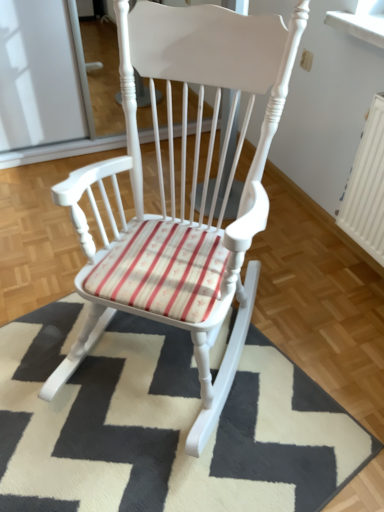
Identify the location of white wood rocking chair at center. This screenshot has height=512, width=384. (183, 185).

The height and width of the screenshot is (512, 384). What do you see at coordinates (183, 185) in the screenshot?
I see `white wood rocking chair at center` at bounding box center [183, 185].

Image resolution: width=384 pixels, height=512 pixels. What are the coordinates of `white textured mat at center` in the screenshot? It's located at (163, 424).

What is the approximate width of white textured mat at center?

The width of white textured mat at center is 1.06 meters.

Measure the distance between white textured mat at center and camera.

white textured mat at center is 1.21 meters away from camera.

What do you see at coordinates (163, 424) in the screenshot? I see `white textured mat at center` at bounding box center [163, 424].

Where is `white wood rocking chair at center`? white wood rocking chair at center is located at coordinates (183, 185).

Can you confirm if white wood rocking chair at center is positioned to the right of white textured mat at center?

Yes, white wood rocking chair at center is to the right of white textured mat at center.

Considering the positions of objects white wood rocking chair at center and white textured mat at center in the image provided, who is behind, white wood rocking chair at center or white textured mat at center?

white textured mat at center is further from the camera.

Is point (283, 62) behind point (230, 501)?

No, it is in front of (230, 501).

From the image's perspective, between white wood rocking chair at center and white textured mat at center, who is located below?

white textured mat at center is shown below in the image.

From a real-world perspective, is white wood rocking chair at center positioned above or below white textured mat at center?

From a real-world perspective, white wood rocking chair at center is physically above white textured mat at center.

Is white wood rocking chair at center wider than white textured mat at center?

No, white wood rocking chair at center is not wider than white textured mat at center.

Between white wood rocking chair at center and white textured mat at center, which one has more height?

white wood rocking chair at center is taller.

Based on their sizes in the image, would you say white wood rocking chair at center is bigger or smaller than white textured mat at center?

In the image, white wood rocking chair at center appears to be larger than white textured mat at center.

Is white wood rocking chair at center positioned beyond the bounds of white textured mat at center?

white wood rocking chair at center is positioned outside white textured mat at center.

Are white wood rocking chair at center and white textured mat at center far apart?

They are positioned close to each other.

Is white wood rocking chair at center oriented away from white textured mat at center?

No, white wood rocking chair at center's orientation is not away from white textured mat at center.

How distant is white wood rocking chair at center from white textured mat at center?

A distance of 14.26 inches exists between white wood rocking chair at center and white textured mat at center.

What are the coordinates of `chair above the white textured mat at center (from the image's perspective)` in the screenshot? It's located at (183, 185).

Between white textured mat at center and white wood rocking chair at center, which one appears on the right side from the viewer's perspective?

white wood rocking chair at center is more to the right.

Is white textured mat at center in front of or behind white wood rocking chair at center in the image?

white textured mat at center is behind white wood rocking chair at center.

Is point (100, 432) closer or farther from the camera than point (181, 46)?

Point (100, 432) is farther from the camera than point (181, 46).

From the image's perspective, is white textured mat at center above or below white wood rocking chair at center?

Clearly, from the image's perspective, white textured mat at center is below white wood rocking chair at center.

From a real-world perspective, does white textured mat at center sit lower than white wood rocking chair at center?

Correct, in the physical world, white textured mat at center is lower than white wood rocking chair at center.

Based on the photo, in terms of width, does white textured mat at center look wider or thinner when compared to white wood rocking chair at center?

Clearly, white textured mat at center has more width compared to white wood rocking chair at center.

Is white textured mat at center taller than white wood rocking chair at center?

Incorrect, the height of white textured mat at center is not larger of that of white wood rocking chair at center.

Who is bigger, white textured mat at center or white wood rocking chair at center?

white wood rocking chair at center is bigger.

Could white wood rocking chair at center be considered to be inside white textured mat at center?

That's incorrect, white wood rocking chair at center is not inside white textured mat at center.

Are white textured mat at center and white wood rocking chair at center making contact?

white textured mat at center is not next to white wood rocking chair at center, and they're not touching.

Is white textured mat at center facing away from white wood rocking chair at center?

No, white wood rocking chair at center is not at the back of white textured mat at center.

How many degrees apart are the facing directions of white textured mat at center and white wood rocking chair at center?

33.3 degrees separate the facing orientations of white textured mat at center and white wood rocking chair at center.

How far apart are white textured mat at center and white wood rocking chair at center?

white textured mat at center is 14.26 inches away from white wood rocking chair at center.

The width and height of the screenshot is (384, 512). I want to click on mat on the left of white wood rocking chair at center, so coord(163,424).

The image size is (384, 512). Identify the location of mat located underneath the white wood rocking chair at center (from a real-world perspective). (163, 424).

The height and width of the screenshot is (512, 384). I want to click on mat on the left of the white wood rocking chair at center, so click(x=163, y=424).